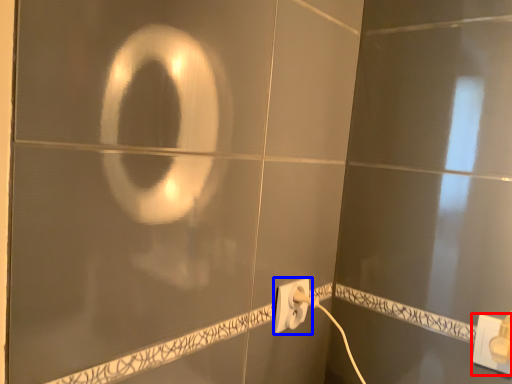
Question: Among these objects, which one is farthest to the camera, power plugs and sockets (highlighted by a red box) or power plugs and sockets (highlighted by a blue box)?

Choices:
 (A) power plugs and sockets
 (B) power plugs and sockets

Answer: (B)